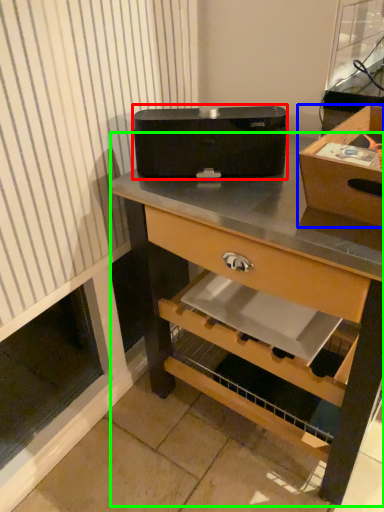
Question: Which is nearer to the appliance (highlighted by a red box)? box (highlighted by a blue box) or desk (highlighted by a green box).

Choices:
 (A) box
 (B) desk

Answer: (B)